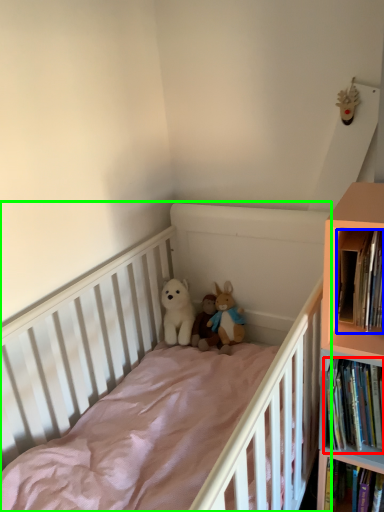
Question: Which object is positioned farthest from book (highlighted by a red box)? Select from book (highlighted by a blue box) and infant bed (highlighted by a green box).

Choices:
 (A) book
 (B) infant bed

Answer: (B)